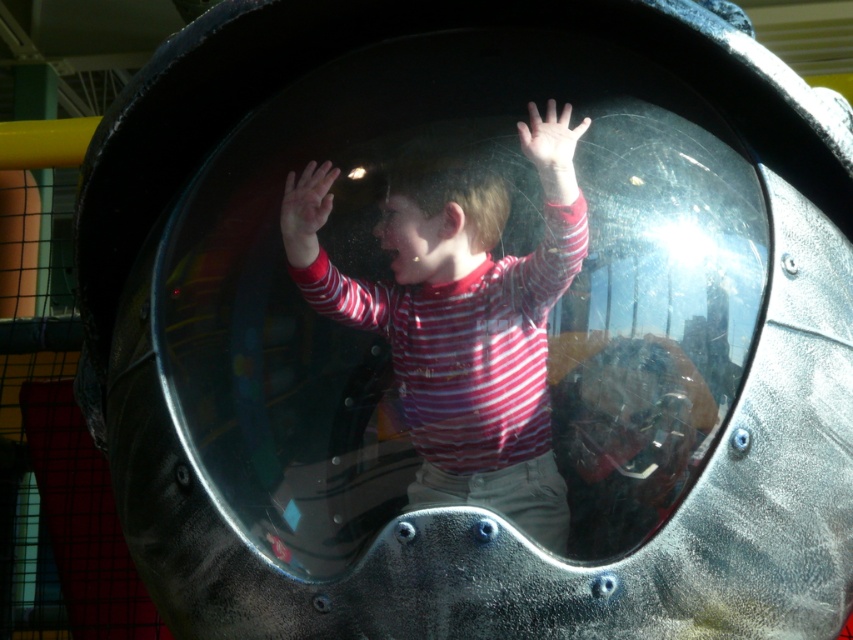
Question: Considering the relative positions of transparent plastic bubble at center and smooth skin hand at upper center in the image provided, where is transparent plastic bubble at center located with respect to smooth skin hand at upper center?

Choices:
 (A) below
 (B) above

Answer: (A)

Question: Does striped fabric child at center have a smaller size compared to smooth skin hand at upper center?

Choices:
 (A) no
 (B) yes

Answer: (A)

Question: Which point is farther to the camera?

Choices:
 (A) transparent plastic bubble at center
 (B) matte red striped shirt at center
 (C) striped fabric child at center
 (D) smooth skin hand at upper center

Answer: (B)

Question: Which object is farther from the camera taking this photo?

Choices:
 (A) smooth skin hand at upper center
 (B) striped fabric child at center
 (C) matte red striped shirt at center
 (D) transparent plastic bubble at center

Answer: (C)

Question: In this image, where is striped fabric child at center located relative to smooth skin hand at upper center?

Choices:
 (A) above
 (B) below

Answer: (B)

Question: Estimate the real-world distances between objects in this image. Which object is farther from the transparent plastic bubble at center?

Choices:
 (A) striped fabric child at center
 (B) smooth skin hand at upper center
 (C) matte red striped shirt at center

Answer: (C)